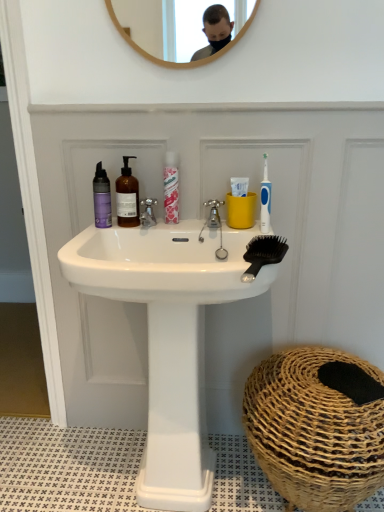
What do you see at coordinates (263, 254) in the screenshot? The width and height of the screenshot is (384, 512). I see `black plastic comb at upper right` at bounding box center [263, 254].

Identify the location of silver metallic faucet at center, arranged as the first tap when viewed from the left. This screenshot has height=512, width=384. (148, 212).

The height and width of the screenshot is (512, 384). What do you see at coordinates (213, 214) in the screenshot?
I see `silver metallic tap at center, the 2th tap positioned from the left` at bounding box center [213, 214].

You are a GUI agent. You are given a task and a screenshot of the screen. Output one action in this format:
    pyautogui.click(x=<x>, y=<y>)
    Task: Click on the purple matte bottle at left, which is the first mouthwash in left-to-right order
    
    Given the screenshot: What is the action you would take?
    pyautogui.click(x=102, y=198)

Is black plastic comb at upper right at the back of translucent amber bottle at center, acting as the 2th mouthwash starting from the left?

No, translucent amber bottle at center, acting as the 2th mouthwash starting from the left, is not facing the opposite direction of black plastic comb at upper right.

Could black plastic comb at upper right be considered to be inside translucent amber bottle at center, acting as the 2th mouthwash starting from the left?

No.

Relative to black plastic comb at upper right, is translucent amber bottle at center, acting as the 2th mouthwash starting from the left, in front or behind?

In the image, translucent amber bottle at center, acting as the 2th mouthwash starting from the left, appears behind black plastic comb at upper right.

Between translucent amber bottle at center, acting as the 2th mouthwash starting from the left, and black plastic comb at upper right, which one has smaller size?

black plastic comb at upper right.

Could you tell me if purple matte bottle at left, which is the first mouthwash in left-to-right order, is turned towards silver metallic faucet at center, arranged as the first tap when viewed from the left?

No, purple matte bottle at left, which is the first mouthwash in left-to-right order, is not turned towards silver metallic faucet at center, arranged as the first tap when viewed from the left.

Who is smaller, purple matte bottle at left, which is the first mouthwash in left-to-right order, or silver metallic faucet at center, which appears as the 2th tap when viewed from the right?

Smaller between the two is silver metallic faucet at center, which appears as the 2th tap when viewed from the right.

Between purple matte bottle at left, which is the first mouthwash in left-to-right order, and silver metallic faucet at center, arranged as the first tap when viewed from the left, which one appears on the left side from the viewer's perspective?

From the viewer's perspective, purple matte bottle at left, which is the first mouthwash in left-to-right order, appears more on the left side.

Does point (267, 238) come farther from viewer compared to point (96, 210)?

No, it is in front of (96, 210).

Is black plastic comb at upper right at the left side of purple matte bottle at left, placed as the third mouthwash when sorted from right to left?

Incorrect, black plastic comb at upper right is not on the left side of purple matte bottle at left, placed as the third mouthwash when sorted from right to left.

Does black plastic comb at upper right have a greater width compared to purple matte bottle at left, which is the first mouthwash in left-to-right order?

Yes.

How different are the orientations of black plastic comb at upper right and purple matte bottle at left, which is the first mouthwash in left-to-right order, in degrees?

16 degrees.

Who is smaller, purple matte bottle at left, which is the first mouthwash in left-to-right order, or silver metallic tap at center, the 2th tap positioned from the left?

silver metallic tap at center, the 2th tap positioned from the left.

Which is behind, point (97, 218) or point (217, 207)?

Point (217, 207)

This screenshot has width=384, height=512. I want to click on the 2nd mouthwash behind the silver metallic tap at center, which is the 1th tap in right-to-left order, starting your count from the anchor, so click(x=102, y=198).

From a real-world perspective, between purple matte bottle at left, placed as the third mouthwash when sorted from right to left, and silver metallic tap at center, which is the 1th tap in right-to-left order, who is vertically higher?

In real-world perspective, purple matte bottle at left, placed as the third mouthwash when sorted from right to left, is above.

You are a GUI agent. You are given a task and a screenshot of the screen. Output one action in this format:
    pyautogui.click(x=<x>, y=<y>)
    Task: Click on the toothbrush in front of the silver metallic faucet at center, which appears as the 2th tap when viewed from the right
    This screenshot has width=384, height=512.
    Given the screenshot: What is the action you would take?
    pyautogui.click(x=265, y=199)

Does silver metallic faucet at center, which appears as the 2th tap when viewed from the right, come behind blue plastic toothbrush at upper right?

That is True.

From a real-world perspective, who is located higher, silver metallic faucet at center, which appears as the 2th tap when viewed from the right, or blue plastic toothbrush at upper right?

blue plastic toothbrush at upper right is physically above.

Is silver metallic faucet at center, which appears as the 2th tap when viewed from the right, not within blue plastic toothbrush at upper right?

Yes, silver metallic faucet at center, which appears as the 2th tap when viewed from the right, is not within blue plastic toothbrush at upper right.

How far apart are white glossy sink at center and translucent amber bottle at center, which is counted as the second mouthwash, starting from the right?

The distance of white glossy sink at center from translucent amber bottle at center, which is counted as the second mouthwash, starting from the right, is 37.28 centimeters.

Is translucent amber bottle at center, acting as the 2th mouthwash starting from the left, at the back of white glossy sink at center?

→ No, white glossy sink at center is not facing away from translucent amber bottle at center, acting as the 2th mouthwash starting from the left.

Can you see white glossy sink at center touching translucent amber bottle at center, which is counted as the second mouthwash, starting from the right?

No, white glossy sink at center is not in contact with translucent amber bottle at center, which is counted as the second mouthwash, starting from the right.

From a real-world perspective, which is physically below, white glossy sink at center or translucent amber bottle at center, which is counted as the second mouthwash, starting from the right?

From a 3D spatial view, white glossy sink at center is below.

Is point (344, 358) less distant than point (145, 218)?

Yes.

Find the location of `basket on the right of silver metallic faucet at center, which appears as the 2th tap when viewed from the right`. basket on the right of silver metallic faucet at center, which appears as the 2th tap when viewed from the right is located at coordinates (317, 426).

Is brown woven basket at lower right touching silver metallic faucet at center, which appears as the 2th tap when viewed from the right?

No, brown woven basket at lower right is not touching silver metallic faucet at center, which appears as the 2th tap when viewed from the right.

This screenshot has width=384, height=512. I want to click on comb lying below the translucent amber bottle at center, which is counted as the second mouthwash, starting from the right (from the image's perspective), so click(x=263, y=254).

Find the location of a particular element. The image size is (384, 512). mouthwash that is the 2nd one when counting leftward from the silver metallic faucet at center, which appears as the 2th tap when viewed from the right is located at coordinates (102, 198).

Which object lies further to the anchor point silver metallic faucet at center, which appears as the 2th tap when viewed from the right, brown woven basket at lower right or silver metallic tap at center, which is the 1th tap in right-to-left order?

brown woven basket at lower right is positioned further to the anchor silver metallic faucet at center, which appears as the 2th tap when viewed from the right.

Which object lies further to the anchor point translucent amber bottle at center, which is counted as the second mouthwash, starting from the right, purple matte bottle at left, placed as the third mouthwash when sorted from right to left, or pink glossy mouthwash at center, which ranks as the 3th mouthwash in left-to-right order?

Based on the image, pink glossy mouthwash at center, which ranks as the 3th mouthwash in left-to-right order, appears to be further to translucent amber bottle at center, which is counted as the second mouthwash, starting from the right.

Looking at the image, which one is located further to brown woven basket at lower right, black plastic comb at upper right or white glossy sink at center?

Based on the image, black plastic comb at upper right appears to be further to brown woven basket at lower right.

From the image, which object appears to be nearer to brown woven basket at lower right, silver metallic faucet at center, which appears as the 2th tap when viewed from the right, or white glossy sink at center?

white glossy sink at center lies closer to brown woven basket at lower right than the other object.

When comparing their distances from translucent amber bottle at center, which is counted as the second mouthwash, starting from the right, does blue plastic toothbrush at upper right or white glossy sink at center seem further?

blue plastic toothbrush at upper right is further to translucent amber bottle at center, which is counted as the second mouthwash, starting from the right.

Estimate the real-world distances between objects in this image. Which object is closer to translucent amber bottle at center, which is counted as the second mouthwash, starting from the right, brown woven basket at lower right or pink glossy mouthwash at center, which ranks as the 3th mouthwash in left-to-right order?

Among the two, pink glossy mouthwash at center, which ranks as the 3th mouthwash in left-to-right order, is located nearer to translucent amber bottle at center, which is counted as the second mouthwash, starting from the right.

From the image, which object appears to be farther from pink glossy mouthwash at center, which appears as the 1th mouthwash when viewed from the right, purple matte bottle at left, placed as the third mouthwash when sorted from right to left, or silver metallic faucet at center, which appears as the 2th tap when viewed from the right?

The object further to pink glossy mouthwash at center, which appears as the 1th mouthwash when viewed from the right, is purple matte bottle at left, placed as the third mouthwash when sorted from right to left.

Considering their positions, is brown woven basket at lower right positioned further to translucent amber bottle at center, acting as the 2th mouthwash starting from the left, than white glossy sink at center?

brown woven basket at lower right is further to translucent amber bottle at center, acting as the 2th mouthwash starting from the left.

The image size is (384, 512). Find the location of `mouthwash between translucent amber bottle at center, which is counted as the second mouthwash, starting from the right, and silver metallic tap at center, the 2th tap positioned from the left, in the horizontal direction`. mouthwash between translucent amber bottle at center, which is counted as the second mouthwash, starting from the right, and silver metallic tap at center, the 2th tap positioned from the left, in the horizontal direction is located at coordinates tap(171, 188).

Locate an element on the screen. The height and width of the screenshot is (512, 384). comb between pink glossy mouthwash at center, which ranks as the 3th mouthwash in left-to-right order, and brown woven basket at lower right in the up-down direction is located at coordinates (263, 254).

You are a GUI agent. You are given a task and a screenshot of the screen. Output one action in this format:
    pyautogui.click(x=<x>, y=<y>)
    Task: Click on the comb between blue plastic toothbrush at upper right and brown woven basket at lower right vertically
    The width and height of the screenshot is (384, 512).
    Given the screenshot: What is the action you would take?
    pyautogui.click(x=263, y=254)

Identify the location of mouthwash situated between translucent amber bottle at center, acting as the 2th mouthwash starting from the left, and blue plastic toothbrush at upper right from left to right. The height and width of the screenshot is (512, 384). (171, 188).